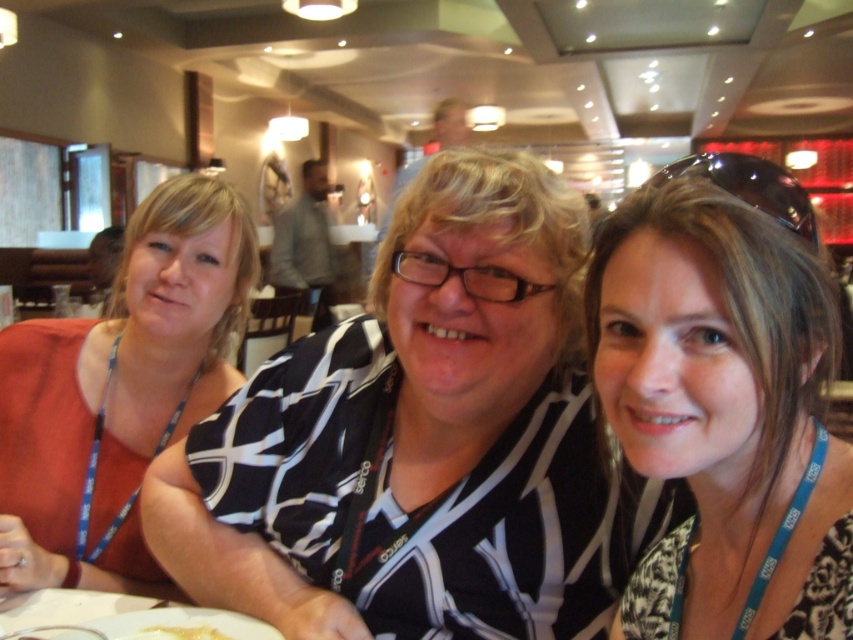
Question: Can you confirm if black and white striped shirt at center is positioned to the right of gray cotton shirt at center?

Choices:
 (A) yes
 (B) no

Answer: (A)

Question: Which object is farther from the camera taking this photo?

Choices:
 (A) gray cotton shirt at center
 (B) white creamy food at lower left
 (C) black and white striped shirt at center

Answer: (A)

Question: Which point is closer to the camera?

Choices:
 (A) (300, 221)
 (B) (753, 301)
 (C) (512, 500)
 (D) (227, 188)

Answer: (B)

Question: Which object is positioned farthest from the matte orange top at left?

Choices:
 (A) black and white striped shirt at center
 (B) gray cotton shirt at center
 (C) matte black shirt at center
 (D) white creamy food at lower left

Answer: (B)

Question: Can you confirm if gray cotton shirt at center is thinner than white creamy food at lower left?

Choices:
 (A) yes
 (B) no

Answer: (B)

Question: Where is black and white striped shirt at center located in relation to matte black shirt at center in the image?

Choices:
 (A) below
 (B) above

Answer: (A)